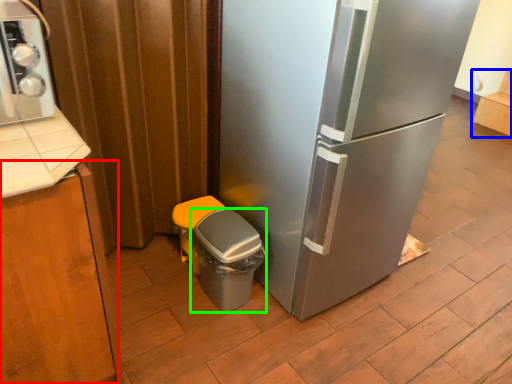
Question: Considering the real-world distances, which object is closest to cabinetry (highlighted by a red box)? cabinetry (highlighted by a blue box) or potty (highlighted by a green box).

Choices:
 (A) cabinetry
 (B) potty

Answer: (B)